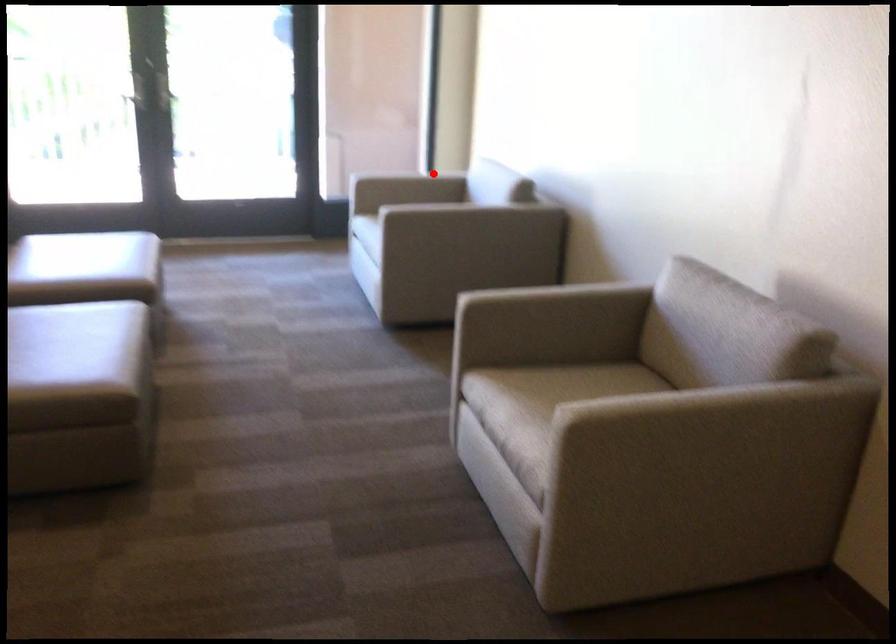
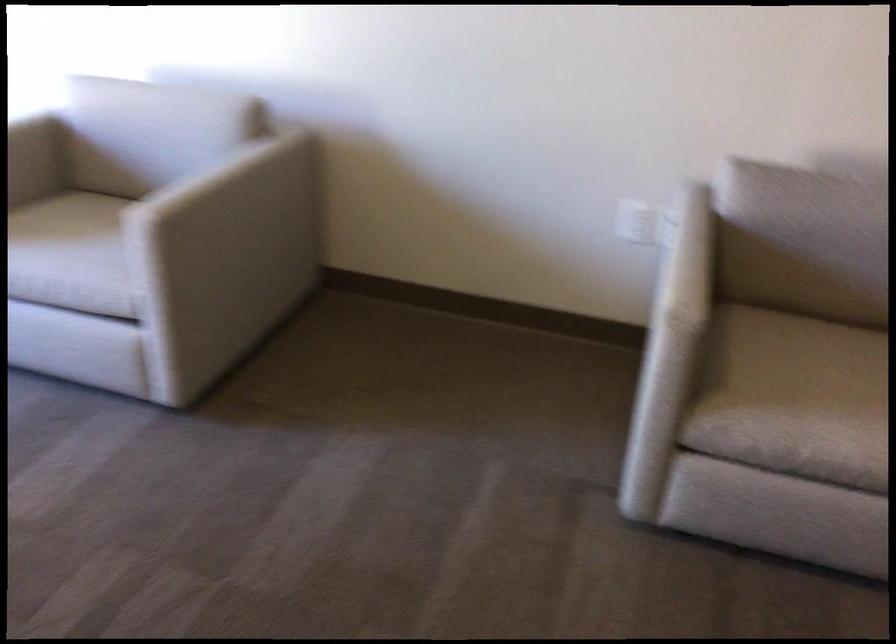
In the second image, find the point that corresponds to the highlighted location in the first image.

(28, 124)